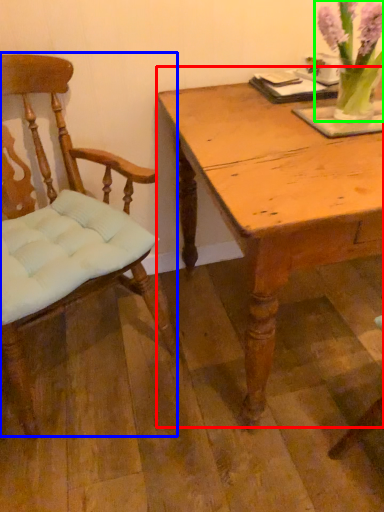
Question: Considering the real-world distances, which object is closest to table (highlighted by a red box)? chair (highlighted by a blue box) or floral arrangement (highlighted by a green box).

Choices:
 (A) chair
 (B) floral arrangement

Answer: (B)